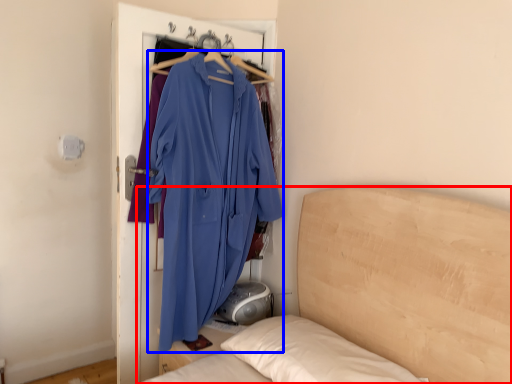
Question: Which object appears farthest to the camera in this image, bed (highlighted by a red box) or fancy dress (highlighted by a blue box)?

Choices:
 (A) bed
 (B) fancy dress

Answer: (B)